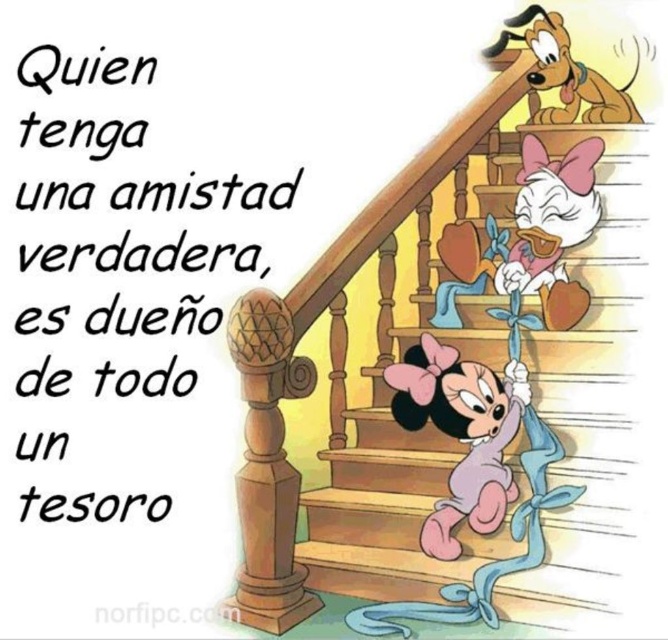
You are standing at the bottom of the stairs and want to reach the point marked by the coordinates (490, 401). Which direction should you go to reach this point from the bottom of the stairs?

The point marked by the coordinates (490, 401) is located at the center of the wooden stairs. Since you are at the bottom of the stairs, you should move upward towards the center to reach this point.

You are standing at point (452, 548) and want to walk to point (623, 172). Since you can only move forward, will you be able to reach the destination without turning around?

Point (623, 172) is behind point (452, 548), so you cannot reach it without turning around because it is located behind your current position.